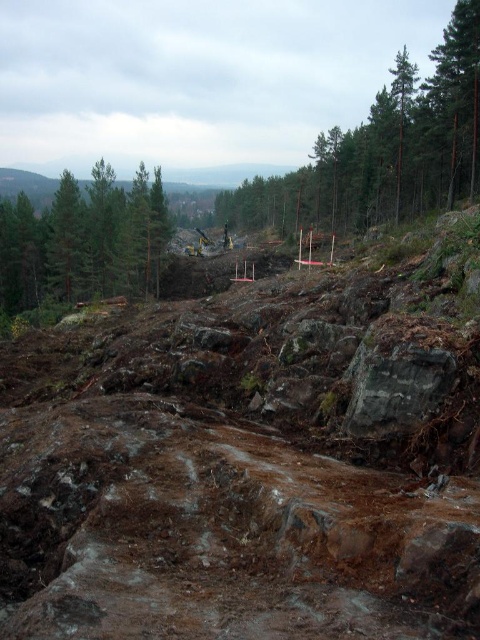
What do you see at coordinates (219, 532) in the screenshot? I see `brown earthy dirt track at center` at bounding box center [219, 532].

Does brown earthy dirt track at center come behind green matte tree at upper left?

No, it is in front of green matte tree at upper left.

Image resolution: width=480 pixels, height=640 pixels. I want to click on brown earthy dirt track at center, so click(x=219, y=532).

Locate an element on the screen. brown earthy dirt track at center is located at coordinates (219, 532).

Can you confirm if gray rough rock at center is positioned to the left of green matte tree at upper left?

In fact, gray rough rock at center is to the right of green matte tree at upper left.

Looking at this image, measure the distance between gray rough rock at center and camera.

gray rough rock at center and camera are 9.39 meters apart from each other.

Who is more distant from viewer, (363, 364) or (59, 234)?

The point (59, 234) is behind.

Where is `gray rough rock at center`? This screenshot has height=640, width=480. gray rough rock at center is located at coordinates pos(395,385).

Who is higher up, green textured tree at center or green textured tree at upper left?

green textured tree at center is above.

Based on the photo, does green textured tree at center have a smaller size compared to green textured tree at upper left?

Incorrect, green textured tree at center is not smaller in size than green textured tree at upper left.

You are a GUI agent. You are given a task and a screenshot of the screen. Output one action in this format:
    pyautogui.click(x=<x>, y=<y>)
    Task: Click on the green textured tree at center
    
    Given the screenshot: What is the action you would take?
    pyautogui.click(x=384, y=148)